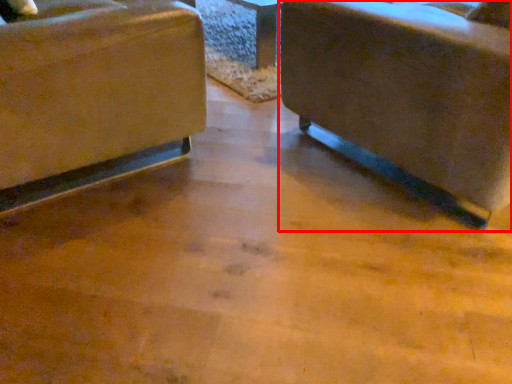
Question: From the image's perspective, where is chair (annotated by the red box) located relative to chair?

Choices:
 (A) above
 (B) below

Answer: (B)